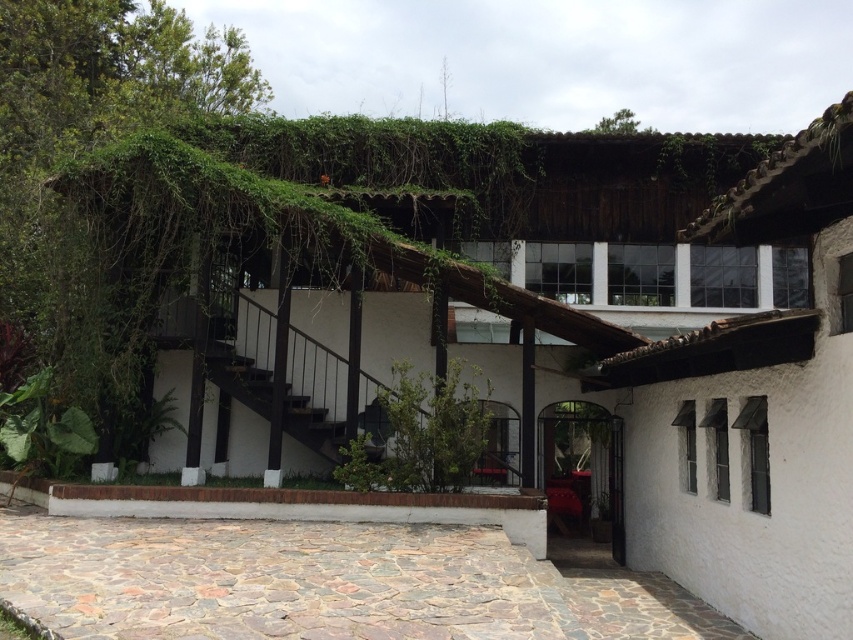
You are a delivery person trying to navigate through the center of the image. You need to place a large package between the green leafy plant at center and the black wooden stairs at center. Is there enough space for the package if it is 1 meter wide?

The green leafy plant at center might be wider than black wooden stairs at center, so the space between them may not be sufficient for a 1 meter wide package. Check the actual width before placing the package.

You are standing at the entrance of the traditional building and want to place a decorative pot exactly at the center of the green leafy plant at center. What are the coordinates where you should place the pot?

The coordinates for placing the decorative pot exactly at the center of the green leafy plant at center are point (421,435).

You are standing in front of the traditional building and want to walk from point A to point B. Point A is located at coordinates point (439, 477) and point B is at point (3, 392). Which point is closer to you when you first arrive at the building?

Point (439, 477) is closer to the viewer than point (3, 392), so you will first encounter point A before reaching point B.